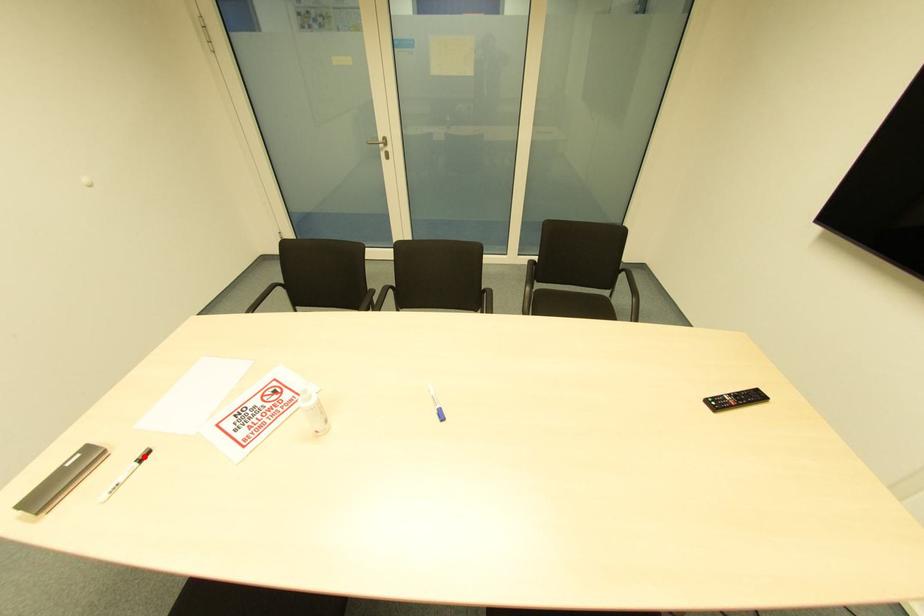
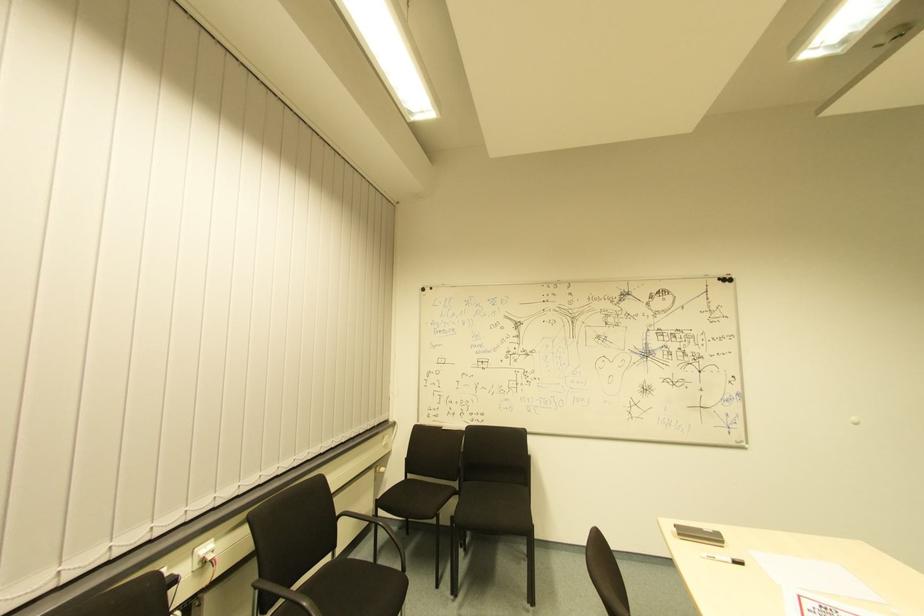
Question: I am providing you with two images of the same scene from different viewpoints. A red point is marked on the first image. At the location where the point appears in image 1, is it still visible in image 2?

Choices:
 (A) Yes
 (B) No

Answer: (A)